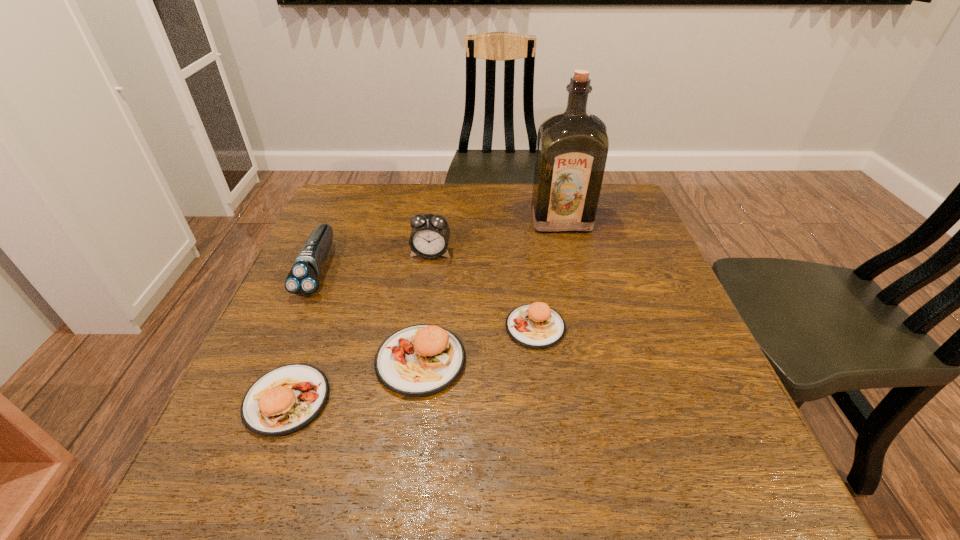
Locate an element on the screen. This screenshot has height=540, width=960. free area in between the shortest patty and the electric shaver is located at coordinates (426, 298).

You are a GUI agent. You are given a task and a screenshot of the screen. Output one action in this format:
    pyautogui.click(x=<x>, y=<y>)
    Task: Click on the unoccupied position between the leftmost patty and the electric shaver
    This screenshot has width=960, height=540.
    Given the screenshot: What is the action you would take?
    pyautogui.click(x=302, y=335)

Locate which object ranks in proximity to the second tallest object. Please provide its 2D coordinates. Your answer should be formatted as a tuple, i.e. [(x, y)], where the tuple contains the x and y coordinates of a point satisfying the conditions above.

[(303, 279)]

The image size is (960, 540). I want to click on the closest object to the electric shaver, so pyautogui.click(x=419, y=360).

The image size is (960, 540). In order to click on the second closest patty to the electric shaver in this screenshot , I will do `click(286, 399)`.

Where is `patty identified as the closest to the second shortest patty`? This screenshot has width=960, height=540. patty identified as the closest to the second shortest patty is located at coordinates (419, 360).

Identify the location of free region that satisfies the following two spatial constraints: 1. on the head of the electric shaver; 2. on the left side of the second shortest patty. The height and width of the screenshot is (540, 960). (262, 400).

Find the location of a particular element. free space that satisfies the following two spatial constraints: 1. on the head of the shortest patty; 2. on the right side of the electric shaver is located at coordinates pyautogui.click(x=293, y=327).

Find the location of a particular element. The image size is (960, 540). vacant space that satisfies the following two spatial constraints: 1. on the front side of the second patty from right to left; 2. on the right side of the second tallest object is located at coordinates (416, 361).

I want to click on free spot that satisfies the following two spatial constraints: 1. on the front side of the alarm clock; 2. on the right side of the second patty from left to right, so click(x=416, y=361).